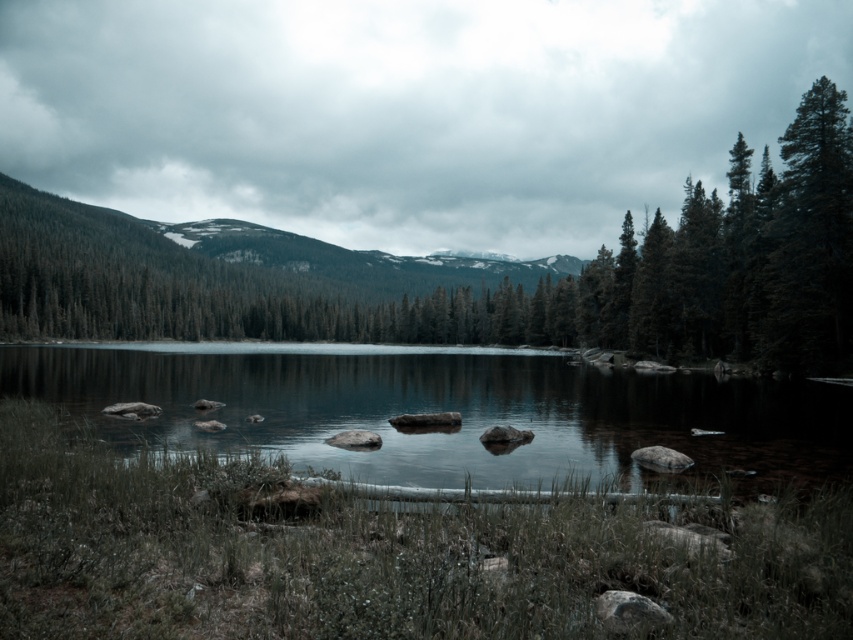
You are standing at the point closer to the camera between the two points, point(53, 336) and point(363, 368). Which point are you at?

You are at point(53, 336) because it is closer to the camera than point(363, 368).

You are standing on the lakeside and want to take a photo of the green matte tree at center and the clear water at center. Which object will appear bigger in your photo?

The green matte tree at center will appear bigger in the photo because it is larger in size than the clear water at center.